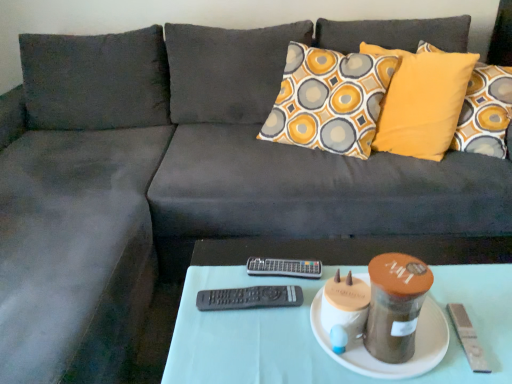
This screenshot has width=512, height=384. I want to click on empty space that is in between black plastic remote at center, the 1th remote when ordered from front to back, and white ceramic plate at center, so click(271, 328).